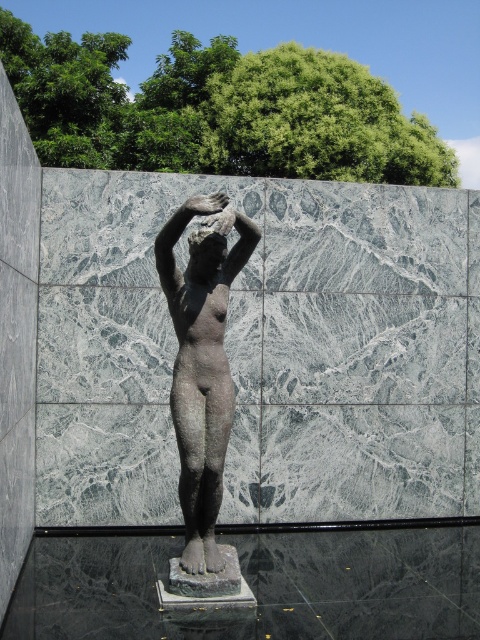
Is point (179, 387) closer to viewer compared to point (211, 276)?

That is True.

Which is below, bronze statue at center or matte bronze head at center?

Positioned lower is bronze statue at center.

Is point (175, 323) behind point (213, 275)?

That is True.

In order to click on bronze statue at center in this screenshot , I will do (x=202, y=362).